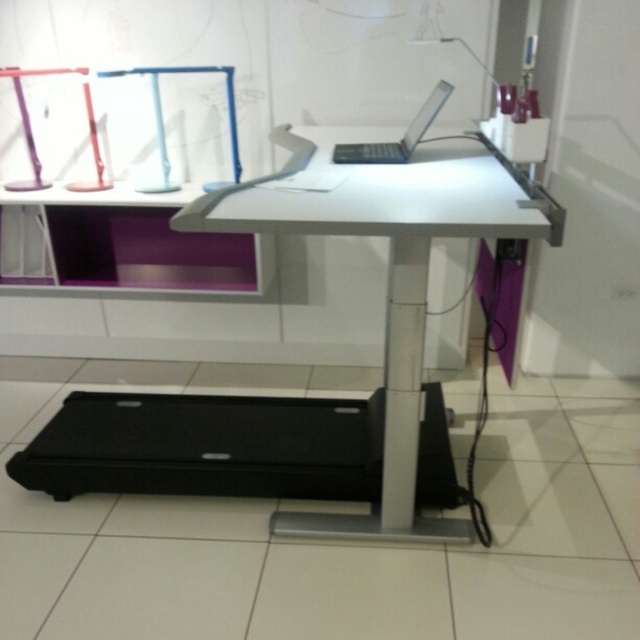
Question: Which object is closer to the camera taking this photo?

Choices:
 (A) satin silver laptop at upper center
 (B) white glossy computer desk at center

Answer: (B)

Question: Where is white glossy computer desk at center located in relation to satin silver laptop at upper center in the image?

Choices:
 (A) below
 (B) above

Answer: (A)

Question: Is white glossy computer desk at center behind satin silver laptop at upper center?

Choices:
 (A) yes
 (B) no

Answer: (B)

Question: Is white glossy computer desk at center in front of satin silver laptop at upper center?

Choices:
 (A) yes
 (B) no

Answer: (A)

Question: Which point appears closest to the camera in this image?

Choices:
 (A) (429, 232)
 (B) (436, 92)

Answer: (A)